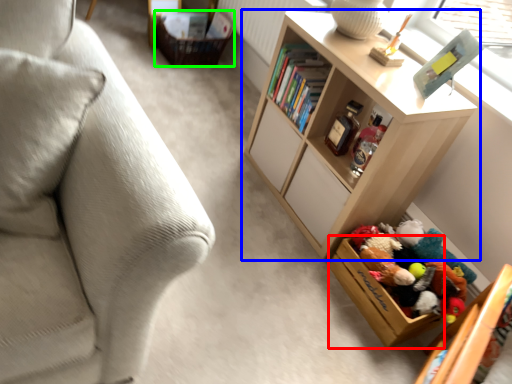
Question: Based on their relative distances, which object is farther from storage box (highlighted by a red box)? Choose from shelf (highlighted by a blue box) and storage box (highlighted by a green box).

Choices:
 (A) shelf
 (B) storage box

Answer: (B)